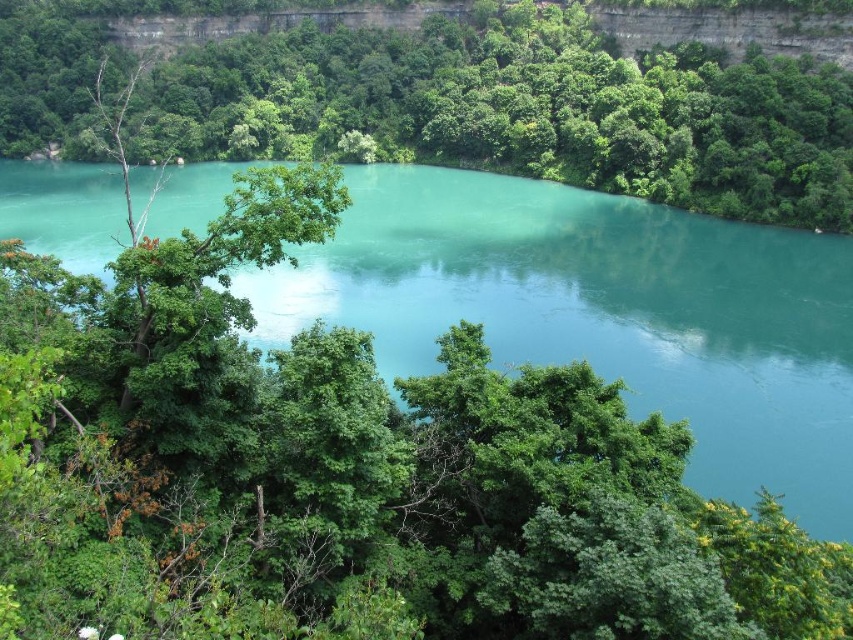
Does turquoise glossy water at center have a greater height compared to green leafy tree at center?

Incorrect, turquoise glossy water at center's height is not larger of green leafy tree at center's.

Is turquoise glossy water at center to the right of green leafy tree at center from the viewer's perspective?

Yes, turquoise glossy water at center is to the right of green leafy tree at center.

Between point (505, 204) and point (763, 72), which one is positioned behind?

Positioned behind is point (505, 204).

The image size is (853, 640). In order to click on turquoise glossy water at center in this screenshot , I will do `click(602, 314)`.